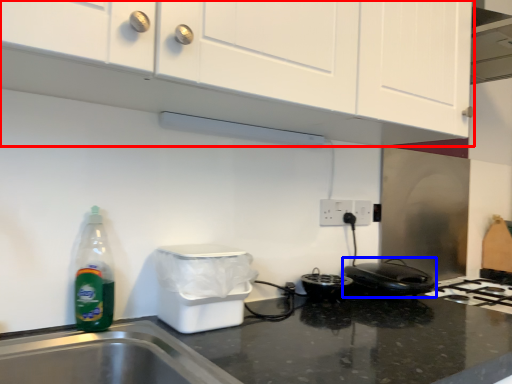
Question: Among these objects, which one is farthest to the camera, cabinetry (highlighted by a red box) or home appliance (highlighted by a blue box)?

Choices:
 (A) cabinetry
 (B) home appliance

Answer: (B)